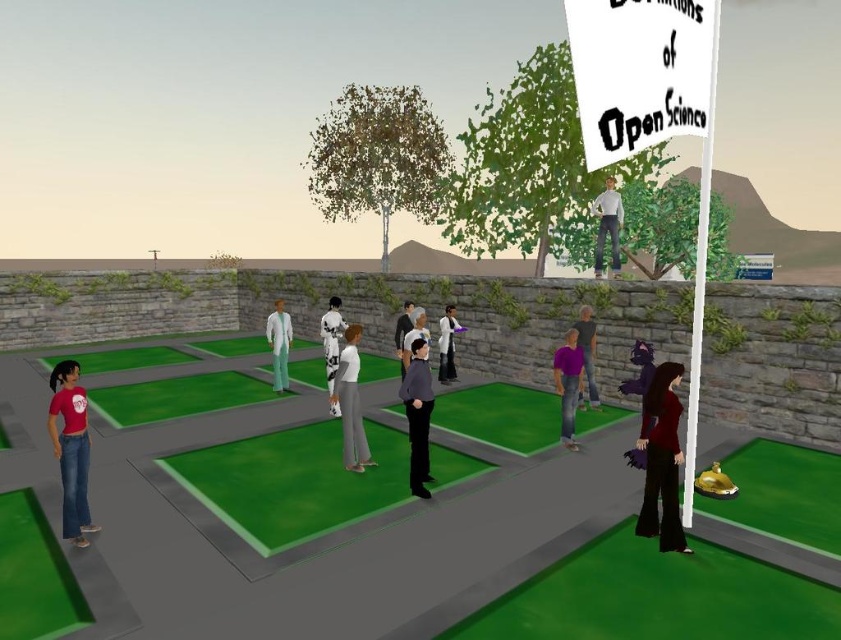
Question: Which object is closer to the camera taking this photo?

Choices:
 (A) white matte suit at center
 (B) white matte coat at center
 (C) light gray fabric shirt at upper center
 (D) smooth black shirt at center

Answer: (D)

Question: Does green turf at center have a larger size compared to velvet burgundy blouse at lower right?

Choices:
 (A) yes
 (B) no

Answer: (A)

Question: Which of the following is the closest to the observer?

Choices:
 (A) (616, 275)
 (B) (588, 371)
 (C) (421, 339)

Answer: (C)

Question: Is purple matte shirt at center to the right of purple fabric dress at center from the viewer's perspective?

Choices:
 (A) yes
 (B) no

Answer: (B)

Question: Which of the following is the farthest from the observer?

Choices:
 (A) purple matte shirt at center
 (B) matte black pants at center
 (C) green turf at center
 (D) matte gray shirt at center

Answer: (D)

Question: Observing the image, what is the correct spatial positioning of light gray fabric shirt at upper center in reference to smooth black shirt at center?

Choices:
 (A) above
 (B) below

Answer: (A)